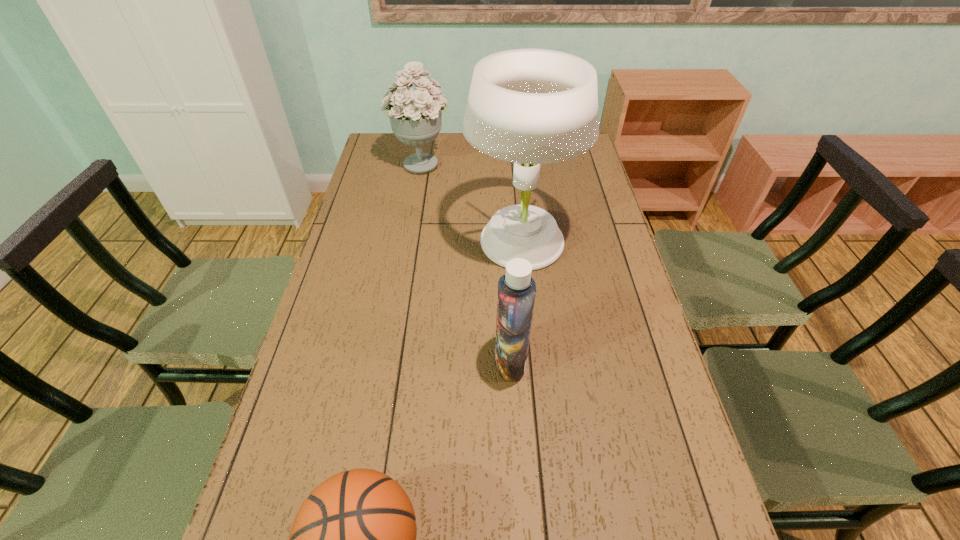
Identify the location of vacant area between the farthest object and the lamp. Image resolution: width=960 pixels, height=540 pixels. (470, 202).

The image size is (960, 540). I want to click on unoccupied position between the third farthest object and the farthest object, so click(x=466, y=262).

Where is `the third closest object to the lamp`? The image size is (960, 540). the third closest object to the lamp is located at coordinates (353, 539).

Where is `object that can be found as the second closest to the shortest object`? The image size is (960, 540). object that can be found as the second closest to the shortest object is located at coordinates (529, 106).